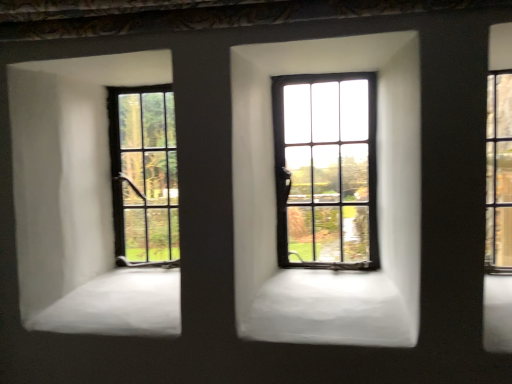
Question: Is the surface of clear glass window at right, which appears as the first window when viewed from the right, in direct contact with matte black window at left, which ranks as the third window in right-to-left order?

Choices:
 (A) no
 (B) yes

Answer: (A)

Question: Can you confirm if clear glass window at right, which appears as the first window when viewed from the right, is bigger than matte black window at left, the first window when ordered from left to right?

Choices:
 (A) no
 (B) yes

Answer: (A)

Question: Is clear glass window at right, acting as the third window starting from the left, facing away from matte black window at left, the first window when ordered from left to right?

Choices:
 (A) yes
 (B) no

Answer: (B)

Question: Is clear glass window at right, which appears as the first window when viewed from the right, not close to matte black window at left, which ranks as the third window in right-to-left order?

Choices:
 (A) no
 (B) yes

Answer: (A)

Question: Does clear glass window at right, which appears as the first window when viewed from the right, appear on the left side of matte black window at left, the first window when ordered from left to right?

Choices:
 (A) no
 (B) yes

Answer: (A)

Question: Is matte black window at center, the 2th window viewed from the left, spatially inside clear glass window at right, acting as the third window starting from the left, or outside of it?

Choices:
 (A) outside
 (B) inside

Answer: (A)

Question: Relative to clear glass window at right, which appears as the first window when viewed from the right, is matte black window at center, the 2th window viewed from the left, in front or behind?

Choices:
 (A) front
 (B) behind

Answer: (B)

Question: From the image's perspective, relative to clear glass window at right, which appears as the first window when viewed from the right, is matte black window at center, which appears as the second window when viewed from the right, above or below?

Choices:
 (A) above
 (B) below

Answer: (B)

Question: From their relative heights in the image, would you say matte black window at center, which appears as the second window when viewed from the right, is taller or shorter than clear glass window at right, which appears as the first window when viewed from the right?

Choices:
 (A) tall
 (B) short

Answer: (A)

Question: From the image's perspective, relative to matte black window at left, the first window when ordered from left to right, is clear glass window at right, acting as the third window starting from the left, above or below?

Choices:
 (A) below
 (B) above

Answer: (B)

Question: Would you say clear glass window at right, acting as the third window starting from the left, is to the left or to the right of matte black window at left, which ranks as the third window in right-to-left order, in the picture?

Choices:
 (A) left
 (B) right

Answer: (B)

Question: In terms of size, does clear glass window at right, which appears as the first window when viewed from the right, appear bigger or smaller than matte black window at left, the first window when ordered from left to right?

Choices:
 (A) big
 (B) small

Answer: (B)

Question: From their relative heights in the image, would you say clear glass window at right, which appears as the first window when viewed from the right, is taller or shorter than matte black window at left, which ranks as the third window in right-to-left order?

Choices:
 (A) tall
 (B) short

Answer: (B)

Question: Is matte black window at center, which appears as the second window when viewed from the right, inside the boundaries of matte black window at left, which ranks as the third window in right-to-left order, or outside?

Choices:
 (A) inside
 (B) outside

Answer: (B)

Question: Considering their positions, is matte black window at center, the 2th window viewed from the left, located in front of or behind matte black window at left, the first window when ordered from left to right?

Choices:
 (A) behind
 (B) front

Answer: (B)